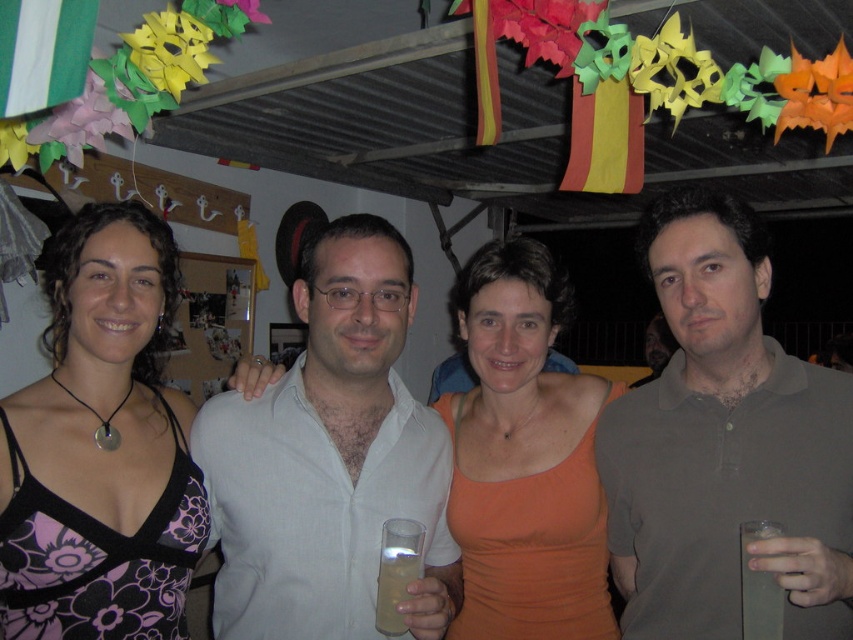
Consider the image. You are at a party and want to get a drink from the clear glass at right without touching the black floral dress at center. Can you reach it safely?

The black floral dress at center is to the left of the clear glass at right, so you can reach the clear glass at right safely without touching the black floral dress at center.

You are at a party and need to decide whether to place a small snack on the white linen shirt at center or the clear plastic cup at center. Which item can accommodate the snack without it falling off?

The white linen shirt at center can accommodate the snack without it falling off because its width is larger than the clear plastic cup at center.

You are at a party and want to hand a drink to the person wearing the white linen shirt at center. The drink is on a tray that can hold items up to 3 feet apart. Can you reach them without moving the tray?

The distance between you and the person wearing the white linen shirt at center is 3.64 feet, which exceeds the tray capacity of 3 feet. You cannot reach them without moving the tray.